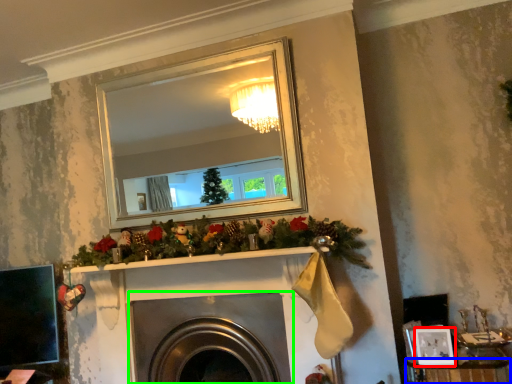
Question: Estimate the real-world distances between objects in this image. Which object is farther from picture frame (highlighted by a red box), furniture (highlighted by a blue box) or fireplace (highlighted by a green box)?

Choices:
 (A) furniture
 (B) fireplace

Answer: (B)